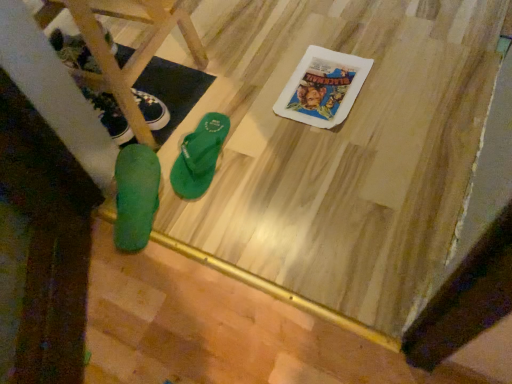
Question: Does green rubber flip-flop at lower left, which is the 2th footwear from left to right, have a greater height compared to green rubber flip-flops at lower left?

Choices:
 (A) yes
 (B) no

Answer: (B)

Question: Is green rubber flip-flop at lower left, acting as the 2th footwear starting from the right, at the right side of green rubber flip-flops at lower left?

Choices:
 (A) yes
 (B) no

Answer: (A)

Question: Are green rubber flip-flop at lower left, which is the 2th footwear from left to right, and green rubber flip-flops at lower left located far from each other?

Choices:
 (A) yes
 (B) no

Answer: (B)

Question: Is green rubber flip-flops at lower left surrounded by green rubber flip-flop at lower left, acting as the 2th footwear starting from the right?

Choices:
 (A) yes
 (B) no

Answer: (B)

Question: From the image's perspective, would you say green rubber flip-flop at lower left, which is the 2th footwear from left to right, is shown under green rubber flip-flops at lower left?

Choices:
 (A) yes
 (B) no

Answer: (A)

Question: Is green rubber flip-flop at lower left, acting as the 2th footwear starting from the right, positioned before green rubber flip-flops at lower left?

Choices:
 (A) yes
 (B) no

Answer: (B)

Question: Is green rubber flip-flop at center, the third footwear positioned from the left, outside of green rubber flip-flop at lower left, acting as the 2th footwear starting from the right?

Choices:
 (A) yes
 (B) no

Answer: (A)

Question: Does green rubber flip-flop at center, the third footwear positioned from the left, have a larger size compared to green rubber flip-flop at lower left, which is the 2th footwear from left to right?

Choices:
 (A) no
 (B) yes

Answer: (A)

Question: From a real-world perspective, is green rubber flip-flop at center, the third footwear positioned from the left, over green rubber flip-flop at lower left, acting as the 2th footwear starting from the right?

Choices:
 (A) no
 (B) yes

Answer: (A)

Question: Would you consider green rubber flip-flop at center, which appears as the 1th footwear when viewed from the right, to be distant from green rubber flip-flop at lower left, acting as the 2th footwear starting from the right?

Choices:
 (A) no
 (B) yes

Answer: (A)

Question: Is green rubber flip-flop at lower left, which is the 2th footwear from left to right, inside green rubber flip-flop at center, the third footwear positioned from the left?

Choices:
 (A) yes
 (B) no

Answer: (B)

Question: Is green rubber flip-flop at center, the third footwear positioned from the left, thinner than green rubber flip-flop at lower left, which is the 2th footwear from left to right?

Choices:
 (A) no
 (B) yes

Answer: (B)

Question: Is green rubber flip-flops at lower left further to camera compared to matte black sneaker at left, marked as the third footwear in a right-to-left arrangement?

Choices:
 (A) yes
 (B) no

Answer: (B)